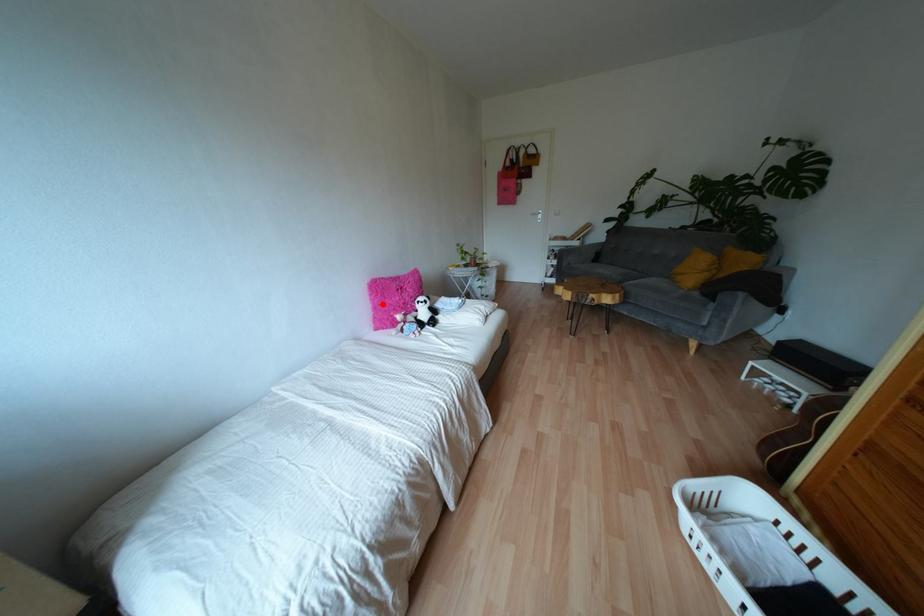
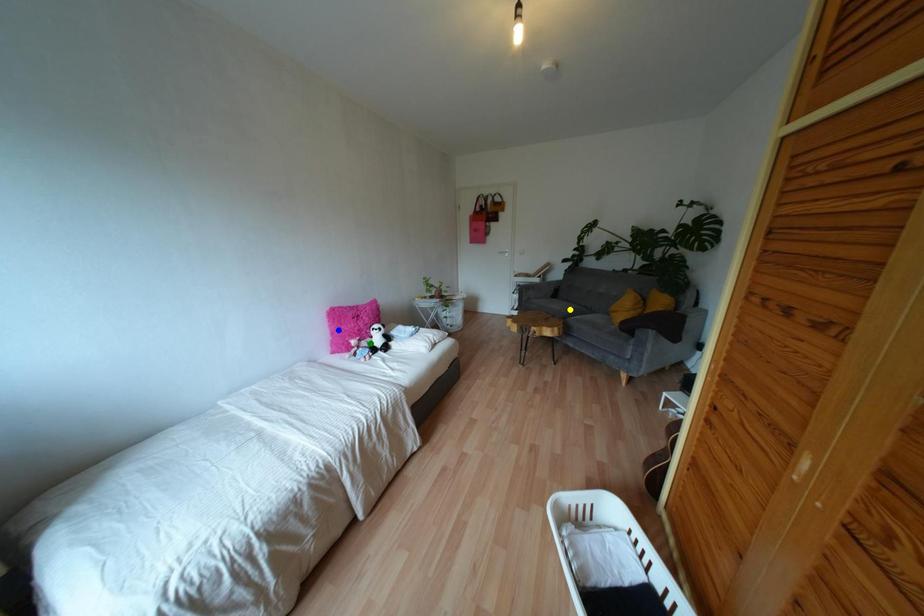
Question: I am providing you with two images of the same scene from different viewpoints. A red point is marked on the first image. You are given multiple points on the second image. Which mark in image 2 goes with the point in image 1?

Choices:
 (A) yellow point
 (B) blue point
 (C) green point

Answer: (B)